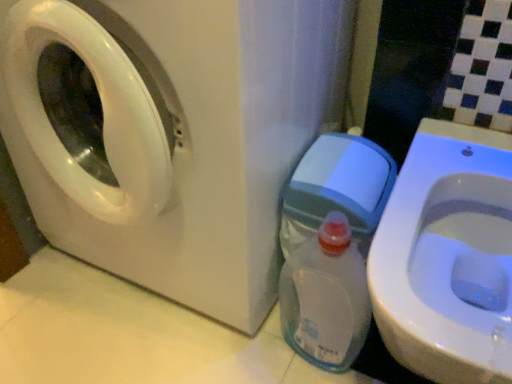
Question: From the image's perspective, is white glossy washing machine at left above or below white glossy toilet at lower right?

Choices:
 (A) below
 (B) above

Answer: (B)

Question: Is white glossy washing machine at left spatially inside white glossy toilet at lower right, or outside of it?

Choices:
 (A) inside
 (B) outside

Answer: (B)

Question: Which object is the closest to the white glossy washing machine at left?

Choices:
 (A) white glossy toilet at lower right
 (B) clear plastic bottle at lower right

Answer: (B)

Question: Which of these objects is positioned farthest from the clear plastic bottle at lower right?

Choices:
 (A) white glossy washing machine at left
 (B) white glossy toilet at lower right

Answer: (A)